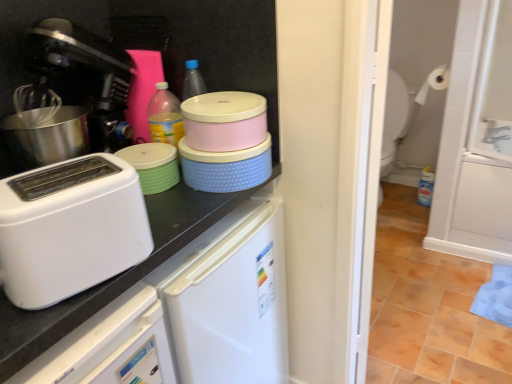
Question: Can you confirm if white plastic toaster at left is positioned to the left of black plastic coffee machine at left?

Choices:
 (A) no
 (B) yes

Answer: (A)

Question: Does white plastic toaster at left contain black plastic coffee machine at left?

Choices:
 (A) no
 (B) yes

Answer: (A)

Question: From the image's perspective, would you say white plastic toaster at left is positioned over black plastic coffee machine at left?

Choices:
 (A) yes
 (B) no

Answer: (B)

Question: Considering the relative positions of white plastic toaster at left and black plastic coffee machine at left in the image provided, is white plastic toaster at left behind black plastic coffee machine at left?

Choices:
 (A) no
 (B) yes

Answer: (A)

Question: Does white plastic toaster at left have a smaller size compared to black plastic coffee machine at left?

Choices:
 (A) no
 (B) yes

Answer: (B)

Question: Is white plastic toaster at left at the right side of black plastic coffee machine at left?

Choices:
 (A) yes
 (B) no

Answer: (A)

Question: From the image's perspective, is white matte countertop at upper left on green matte container at center?

Choices:
 (A) yes
 (B) no

Answer: (B)

Question: Is white matte countertop at upper left facing towards green matte container at center?

Choices:
 (A) no
 (B) yes

Answer: (A)

Question: Does white matte countertop at upper left appear on the left side of green matte container at center?

Choices:
 (A) no
 (B) yes

Answer: (A)

Question: Is white matte countertop at upper left located outside green matte container at center?

Choices:
 (A) yes
 (B) no

Answer: (A)

Question: Is there a large distance between white matte countertop at upper left and green matte container at center?

Choices:
 (A) no
 (B) yes

Answer: (A)

Question: From a real-world perspective, is white matte countertop at upper left beneath green matte container at center?

Choices:
 (A) no
 (B) yes

Answer: (B)

Question: Is white glossy screen door at right oriented away from white matte toilet paper at upper right?

Choices:
 (A) yes
 (B) no

Answer: (B)